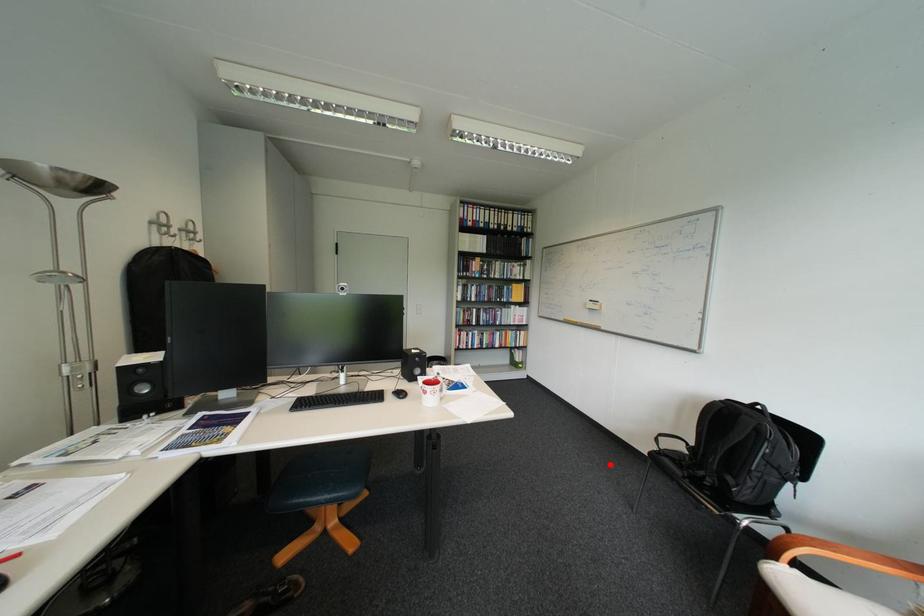
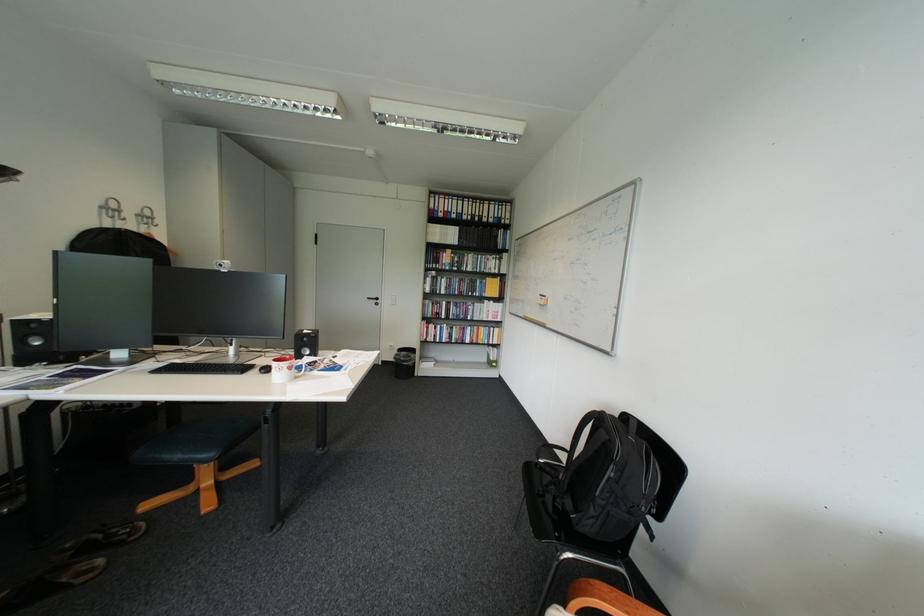
The point at the highlighted location is marked in the first image. Where is the corresponding point in the second image?

(523, 472)